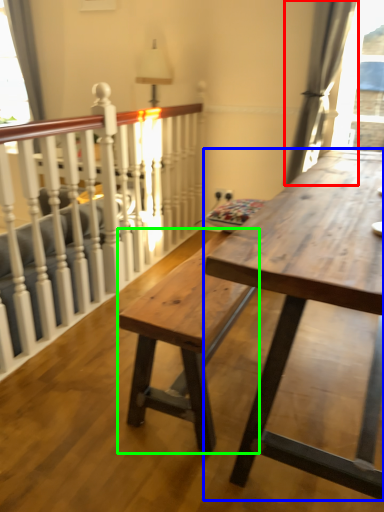
Question: Which object is the closest to the curtain (highlighted by a red box)? Choose among these: table (highlighted by a blue box) or bench (highlighted by a green box).

Choices:
 (A) table
 (B) bench

Answer: (A)